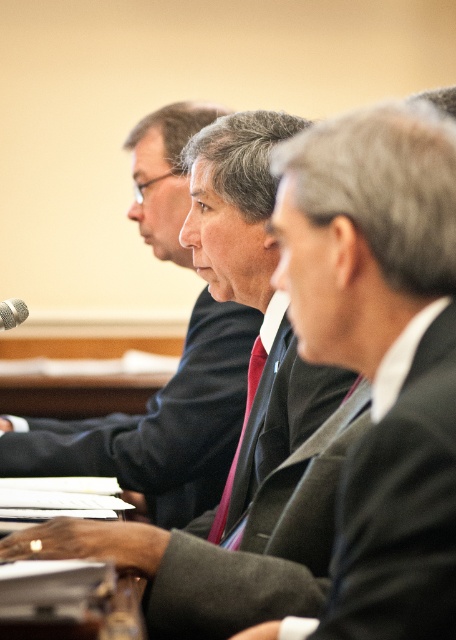
Between silky red tie at center and silver metallic microphone at left, which one is positioned lower?

silky red tie at center

Which is more to the left, silky red tie at center or silver metallic microphone at left?

silver metallic microphone at left is more to the left.

Between point (227, 483) and point (15, 310), which one is positioned behind?

Positioned behind is point (227, 483).

Locate an element on the screen. The image size is (456, 640). silky red tie at center is located at coordinates (239, 436).

Can you confirm if matte black suit at center is shorter than silky red tie at center?

No.

Is matte black suit at center closer to the viewer compared to silky red tie at center?

No, it is not.

Does point (182, 502) come behind point (253, 378)?

That is True.

Locate an element on the screen. This screenshot has height=640, width=456. matte black suit at center is located at coordinates (160, 424).

Describe the element at coordinates (253, 412) in the screenshot. I see `dark gray suit at center` at that location.

Which is behind, point (214, 211) or point (154, 445)?

The point (154, 445) is more distant.

The width and height of the screenshot is (456, 640). What are the coordinates of `dark gray suit at center` in the screenshot? It's located at (253, 412).